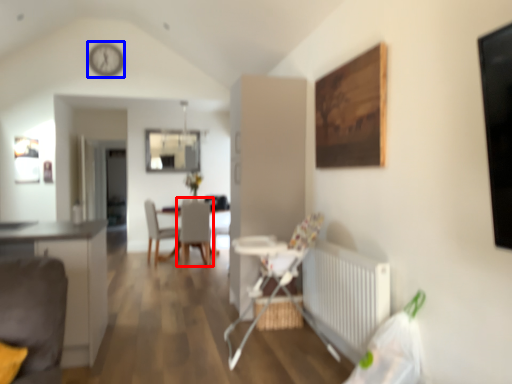
Question: Which object is closer to the camera taking this photo, chair (highlighted by a red box) or clock (highlighted by a blue box)?

Choices:
 (A) chair
 (B) clock

Answer: (A)